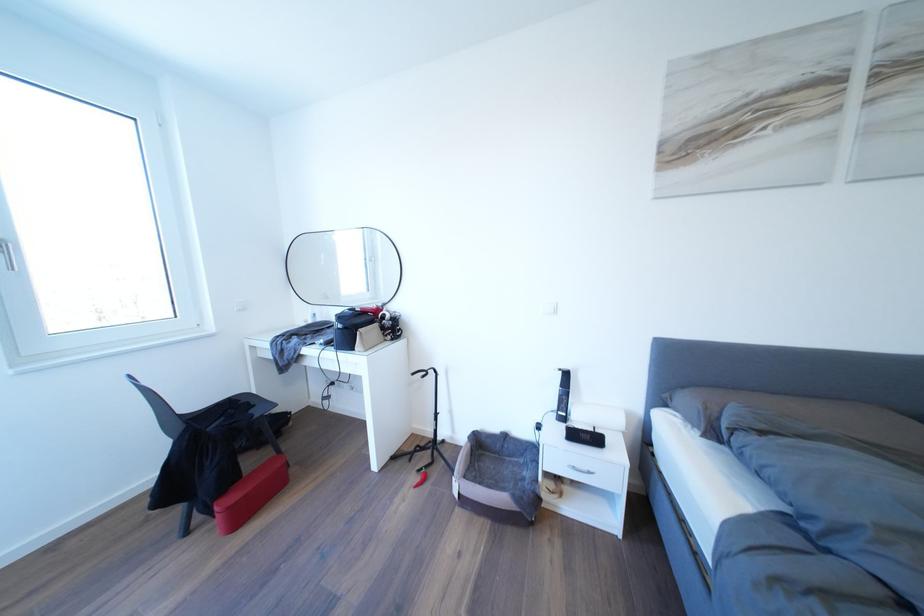
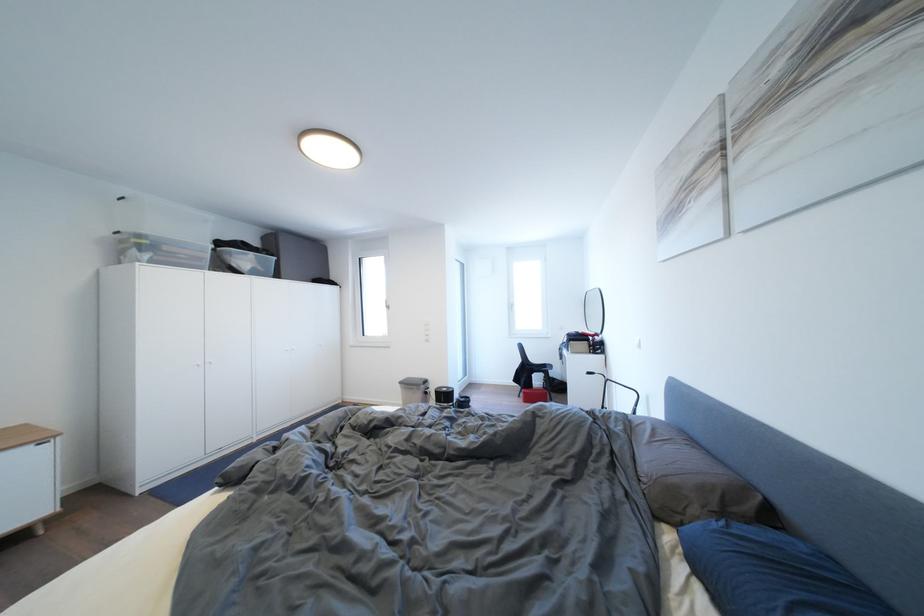
Question: I am providing you with two images of the same scene from different viewpoints. After the viewpoint changes to image2, which objects are now occluded?

Choices:
 (A) bicycle handlebar
 (B) white drawer handle
 (C) oval mirror
 (D) clear storage box

Answer: (B)